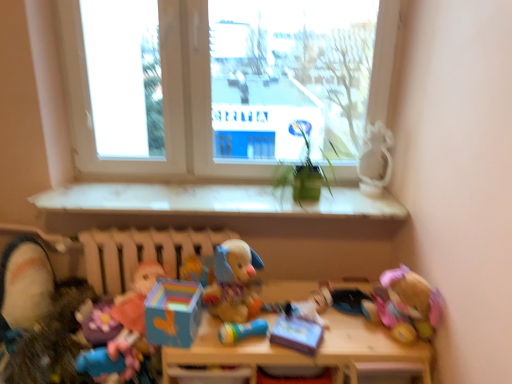
Question: From a real-world perspective, is wooden table at center above or below matte cardboard box at center, the eighth toy viewed from the left?

Choices:
 (A) above
 (B) below

Answer: (B)

Question: Visually, is wooden table at center positioned to the left or to the right of matte cardboard box at center, the eighth toy viewed from the left?

Choices:
 (A) left
 (B) right

Answer: (A)

Question: Estimate the real-world distances between objects in this image. Which object is farther from the soft plush toy at lower left, the tenth toy positioned from the right?

Choices:
 (A) rubber duck at center, which is counted as the fourth toy, starting from the right
 (B) blue plastic toy at lower left, which is the eighth toy from right to left
 (C) transparent glass window at upper center, the 1th window screen viewed from the left
 (D) transparent glass window at center, positioned as the second window screen in left-to-right order
 (E) white glossy statue at upper right, which is counted as the tenth toy, starting from the left

Answer: (C)

Question: Estimate the real-world distances between objects in this image. Which object is closer to the matte cardboard box at center, the eighth toy viewed from the left?

Choices:
 (A) multicolored plastic toy at center, marked as the sixth toy in a right-to-left arrangement
 (B) transparent glass window at upper center, the 1th window screen viewed from the left
 (C) white glossy window sill at center
 (D) plush fabric dog at center, acting as the 5th toy starting from the right
 (E) transparent glass window at center, acting as the first window screen starting from the right

Answer: (D)